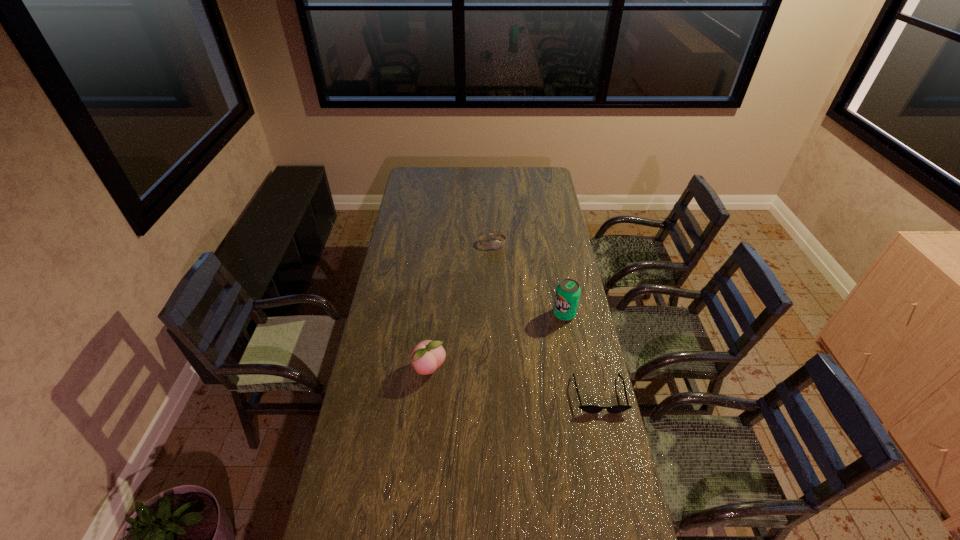
Find the location of `vacant position at the near left corner of the desktop`. vacant position at the near left corner of the desktop is located at coordinates (327, 536).

Find the location of a particular element. free space at the far right corner is located at coordinates (533, 185).

At what (x,y) coordinates should I click in order to perform the action: click on free point between the third tallest object and the sunglasses. Please return your answer as a coordinate pair (x, y). Looking at the image, I should click on (546, 319).

This screenshot has width=960, height=540. Identify the location of free point between the sunglasses and the pop soda. (582, 354).

Locate an element on the screen. free space between the sunglasses and the tallest object is located at coordinates click(x=582, y=354).

Find the location of a particular element. unoccupied area between the second farthest object and the leftmost object is located at coordinates pyautogui.click(x=497, y=342).

Find the location of a particular element. free space between the pop soda and the farthest object is located at coordinates (528, 279).

Image resolution: width=960 pixels, height=540 pixels. Identify the location of vacant space that is in between the peach and the pop soda. (497, 342).

Where is `vacant space that's between the peach and the third object from right to left`? The width and height of the screenshot is (960, 540). vacant space that's between the peach and the third object from right to left is located at coordinates (461, 307).

In order to click on free space between the farthest object and the pop soda in this screenshot , I will do `click(528, 279)`.